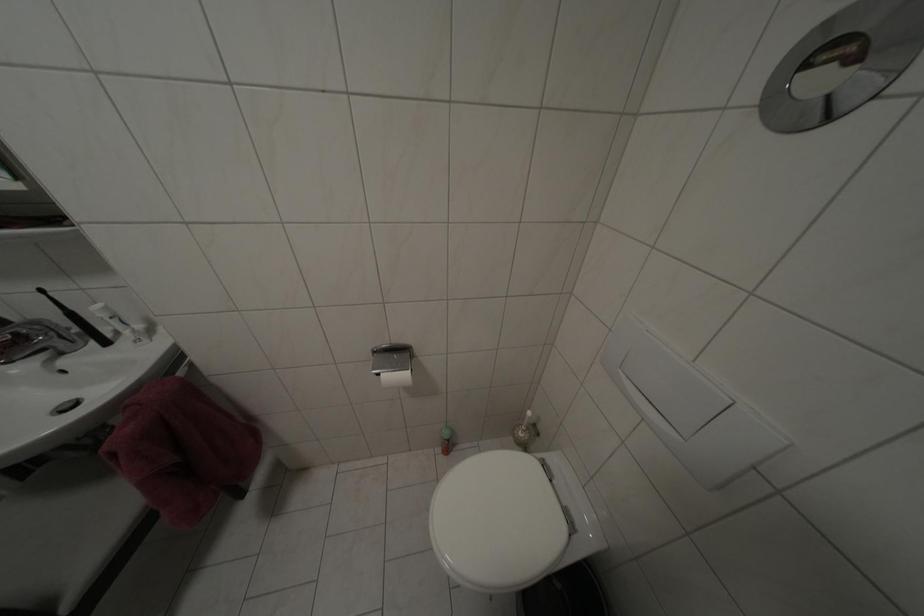
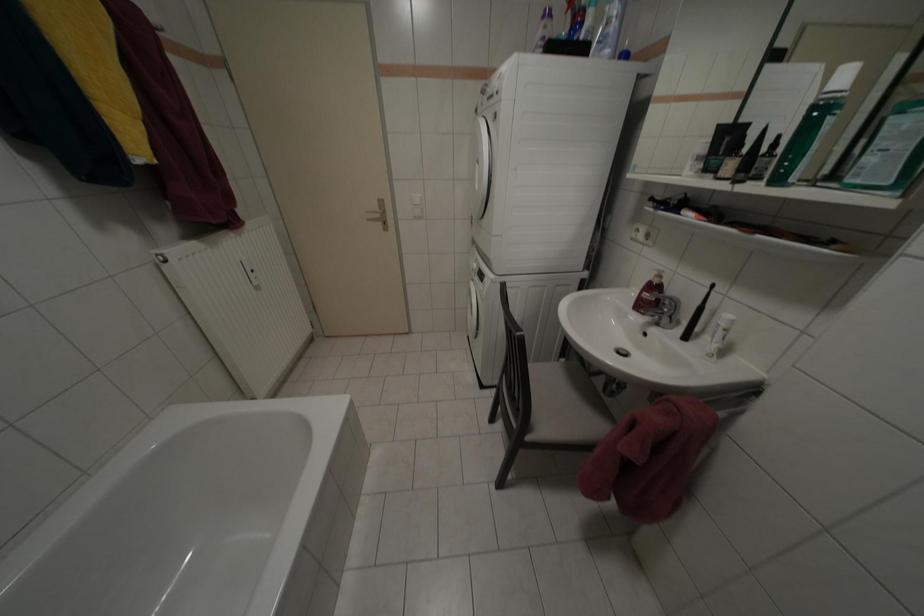
The first image is from the beginning of the video and the second image is from the end. How did the camera likely rotate when shooting the video?

The camera's rotation is toward left-down.